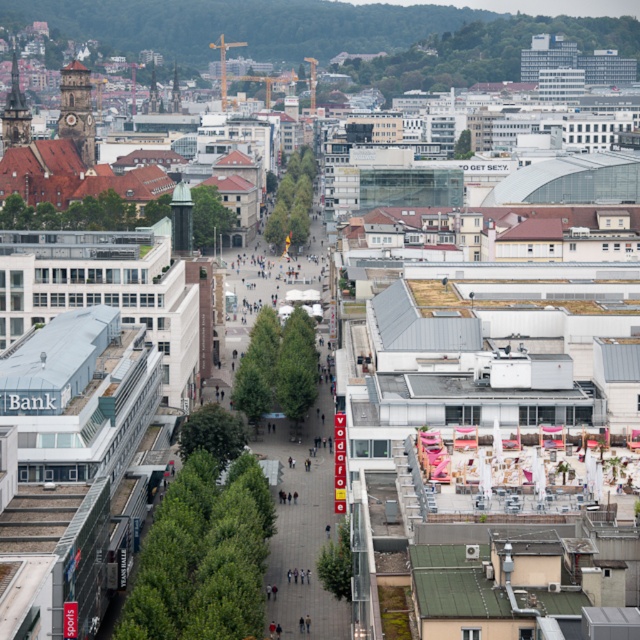
Question: Does brown stone clock tower at upper left have a larger size compared to dark brown stone tower at upper left?

Choices:
 (A) no
 (B) yes

Answer: (A)

Question: Which point is farther from the camera taking this photo?

Choices:
 (A) (13, 51)
 (B) (74, 136)

Answer: (A)

Question: Which point is closer to the camera?

Choices:
 (A) brown stone clock tower at upper left
 (B) dark brown stone tower at upper left

Answer: (B)

Question: Is brown stone clock tower at upper left to the right of dark brown stone tower at upper left from the viewer's perspective?

Choices:
 (A) no
 (B) yes

Answer: (B)

Question: Can you confirm if brown stone clock tower at upper left is positioned to the left of dark brown stone tower at upper left?

Choices:
 (A) yes
 (B) no

Answer: (B)